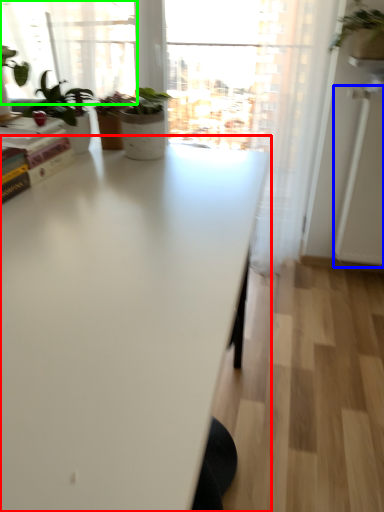
Question: Based on their relative distances, which object is nearer to table (highlighted by a red box)? Choose from screen door (highlighted by a blue box) and bay window (highlighted by a green box).

Choices:
 (A) screen door
 (B) bay window

Answer: (A)